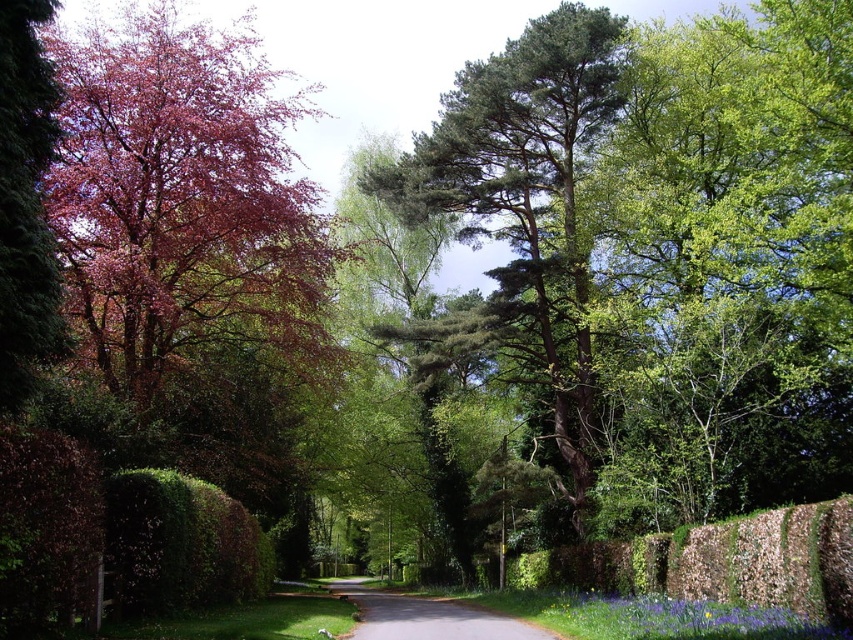
You are a hiker trying to determine the best path forward. You see the green textured tree at center and the gray asphalt road at center. Which object is bigger in size?

The green textured tree at center is larger in size than the gray asphalt road at center.